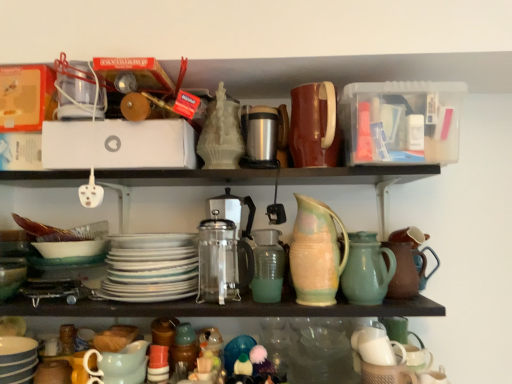
Question: Is matte green mixing bowl at lower left at the back of satin silver coffee machine at center?

Choices:
 (A) yes
 (B) no

Answer: (B)

Question: From a real-world perspective, is satin silver coffee machine at center physically above matte green mixing bowl at lower left?

Choices:
 (A) no
 (B) yes

Answer: (B)

Question: Is satin silver coffee machine at center not inside matte green mixing bowl at lower left?

Choices:
 (A) yes
 (B) no

Answer: (A)

Question: Does satin silver coffee machine at center lie behind matte green mixing bowl at lower left?

Choices:
 (A) no
 (B) yes

Answer: (B)

Question: Does satin silver coffee machine at center have a lesser height compared to matte green mixing bowl at lower left?

Choices:
 (A) yes
 (B) no

Answer: (B)

Question: Is satin silver coffee machine at center in front of or behind pastel glazed pitcher at center, the first jug from the left, in the image?

Choices:
 (A) front
 (B) behind

Answer: (B)

Question: From their relative heights in the image, would you say satin silver coffee machine at center is taller or shorter than pastel glazed pitcher at center, which is the 2th jug from right to left?

Choices:
 (A) tall
 (B) short

Answer: (B)

Question: From a real-world perspective, is satin silver coffee machine at center physically located above or below pastel glazed pitcher at center, which is the 2th jug from right to left?

Choices:
 (A) above
 (B) below

Answer: (B)

Question: Is satin silver coffee machine at center bigger or smaller than pastel glazed pitcher at center, the first jug from the left?

Choices:
 (A) big
 (B) small

Answer: (A)

Question: From a real-world perspective, is brown matte tea pot at right physically located above or below white glossy platter at center?

Choices:
 (A) below
 (B) above

Answer: (A)

Question: From the image's perspective, is brown matte tea pot at right located above or below white glossy platter at center?

Choices:
 (A) below
 (B) above

Answer: (B)

Question: Is brown matte tea pot at right inside the boundaries of white glossy platter at center, or outside?

Choices:
 (A) inside
 (B) outside

Answer: (B)

Question: Based on their sizes in the image, would you say brown matte tea pot at right is bigger or smaller than white glossy platter at center?

Choices:
 (A) small
 (B) big

Answer: (A)

Question: Relative to translucent glass vase at center, is white glossy platter at center in front or behind?

Choices:
 (A) front
 (B) behind

Answer: (A)

Question: From a real-world perspective, relative to translucent glass vase at center, is white glossy platter at center vertically above or below?

Choices:
 (A) below
 (B) above

Answer: (B)